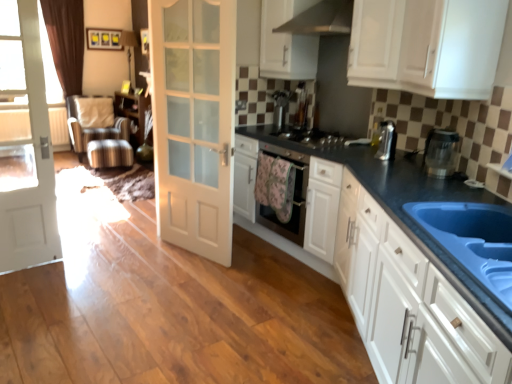
Question: Which direction should I rotate to look at satin silver coffee machine at center, placed as the 1th coffee machine when sorted from left to right?

Choices:
 (A) right
 (B) left

Answer: (A)

Question: Can you confirm if blue composite sink at lower right is bigger than black glossy dishwasher at center?

Choices:
 (A) no
 (B) yes

Answer: (A)

Question: Can we say blue composite sink at lower right lies outside black glossy dishwasher at center?

Choices:
 (A) no
 (B) yes

Answer: (B)

Question: From a real-world perspective, is blue composite sink at lower right beneath black glossy dishwasher at center?

Choices:
 (A) no
 (B) yes

Answer: (A)

Question: Could you tell me if blue composite sink at lower right is facing black glossy dishwasher at center?

Choices:
 (A) no
 (B) yes

Answer: (A)

Question: Can you confirm if blue composite sink at lower right is smaller than black glossy dishwasher at center?

Choices:
 (A) yes
 (B) no

Answer: (A)

Question: Is black glossy dishwasher at center located within blue composite sink at lower right?

Choices:
 (A) no
 (B) yes

Answer: (A)

Question: Can you confirm if white wood door at left, arranged as the 1th door when viewed from the left, is thinner than satin silver coffee machine at upper right, the 2th coffee machine positioned from the left?

Choices:
 (A) no
 (B) yes

Answer: (B)

Question: From the image's perspective, is white wood door at left, arranged as the 1th door when viewed from the left, under satin silver coffee machine at upper right, which is the 1th coffee machine in bottom-to-top order?

Choices:
 (A) yes
 (B) no

Answer: (A)

Question: From a real-world perspective, is white wood door at left, the 2th door positioned from the right, over satin silver coffee machine at upper right, which appears as the first coffee machine when viewed from the front?

Choices:
 (A) no
 (B) yes

Answer: (A)

Question: Does white wood door at left, the 2th door positioned from the right, turn towards satin silver coffee machine at upper right, which appears as the first coffee machine when viewed from the front?

Choices:
 (A) yes
 (B) no

Answer: (B)

Question: Can you confirm if white wood door at left, arranged as the 1th door when viewed from the left, is bigger than satin silver coffee machine at upper right, which is the 1th coffee machine in bottom-to-top order?

Choices:
 (A) no
 (B) yes

Answer: (B)

Question: Does white wood door at left, the 2th door positioned from the right, come in front of satin silver coffee machine at upper right, the 2th coffee machine from the top?

Choices:
 (A) no
 (B) yes

Answer: (B)

Question: Is white glossy cabinets at center, marked as the 4th cabinetry in a top-to-bottom arrangement, surrounded by white glossy cabinet at upper right, positioned as the second cabinetry in bottom-to-top order?

Choices:
 (A) no
 (B) yes

Answer: (A)